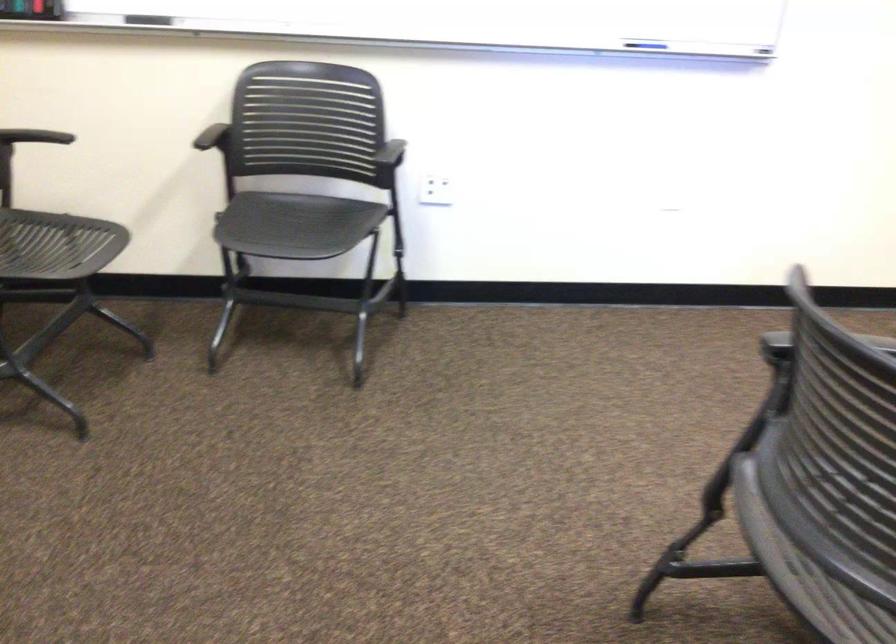
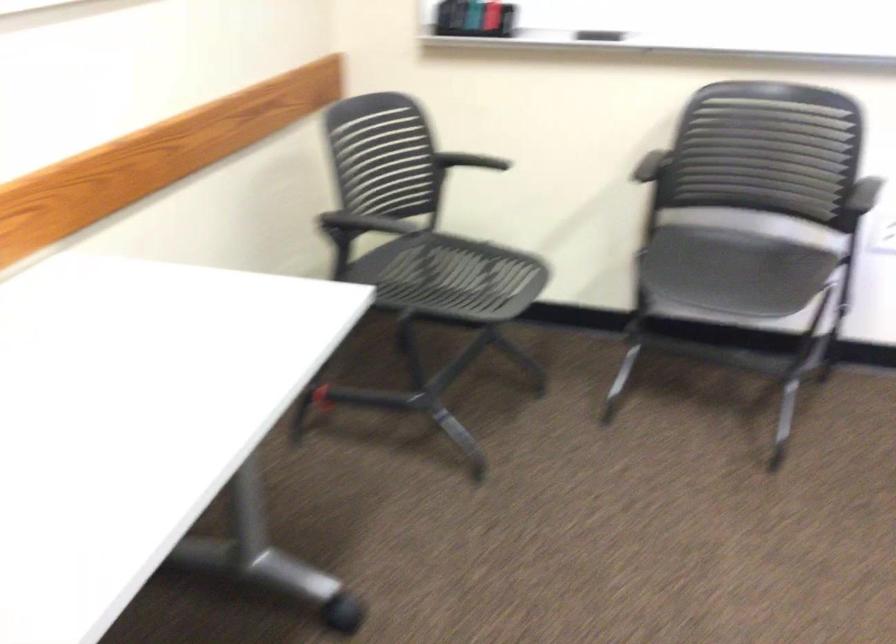
Question: How did the camera likely rotate?

Choices:
 (A) Left
 (B) Right
 (C) Up
 (D) Down

Answer: (A)